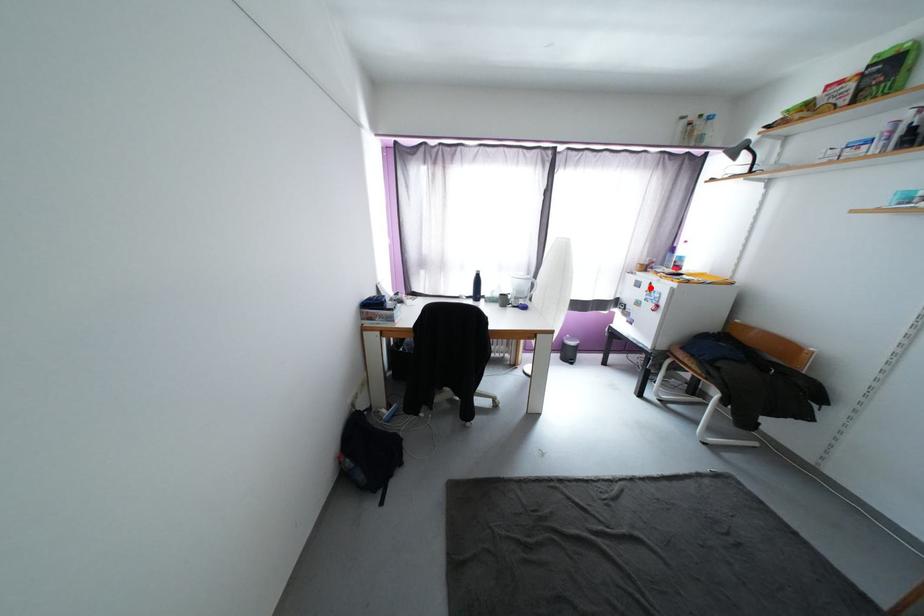
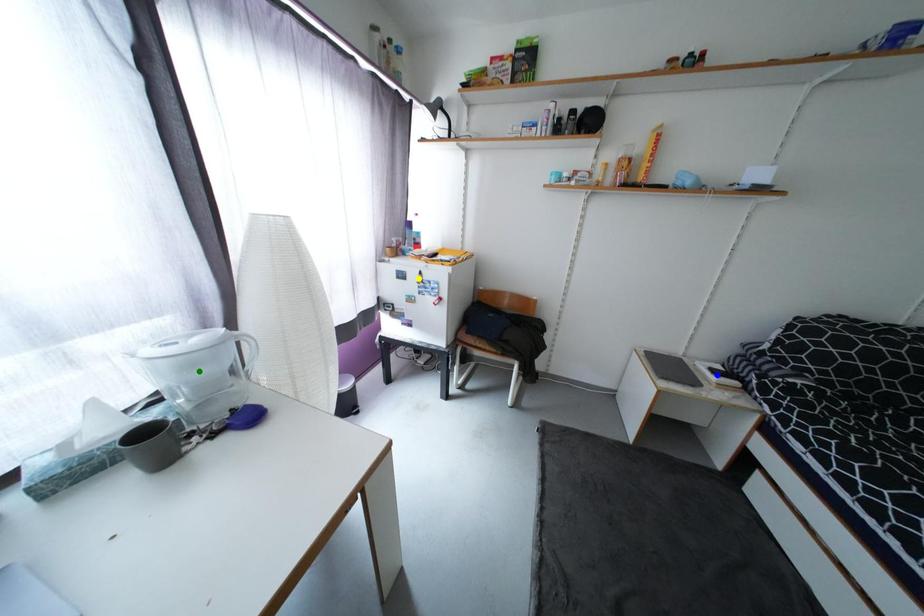
Question: I am providing you with two images of the same scene from different viewpoints. A red point is marked on the first image. You are given multiple points on the second image. Can you choose the point in image 2 that corresponds to the point in image 1?

Choices:
 (A) yellow point
 (B) green point
 (C) blue point

Answer: (A)